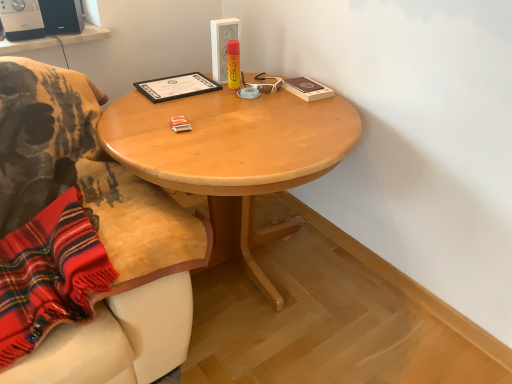
Where is `blank space above light wood table at center (from a real-world perspective)`? The image size is (512, 384). blank space above light wood table at center (from a real-world perspective) is located at coordinates (216, 118).